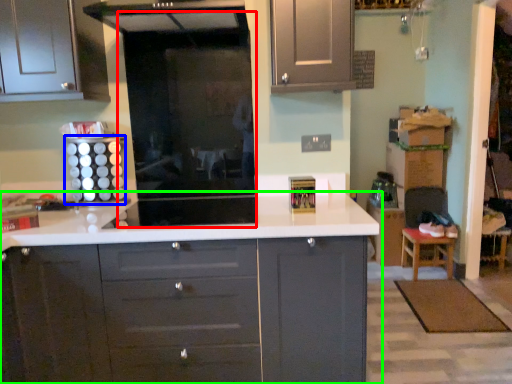
Question: Which is farther away from glass door (highlighted by a red box)? appliance (highlighted by a blue box) or countertop (highlighted by a green box)?

Choices:
 (A) appliance
 (B) countertop

Answer: (B)